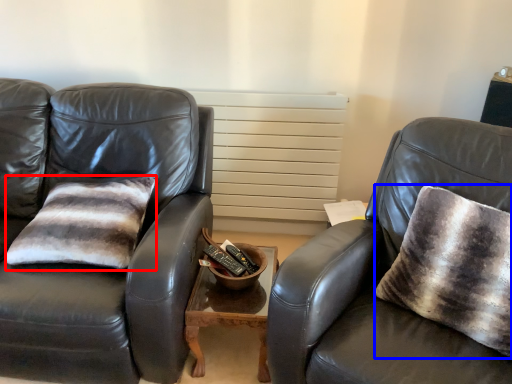
Question: Which of the following is the closest to the observer, pillow (highlighted by a red box) or throw pillow (highlighted by a blue box)?

Choices:
 (A) pillow
 (B) throw pillow

Answer: (B)